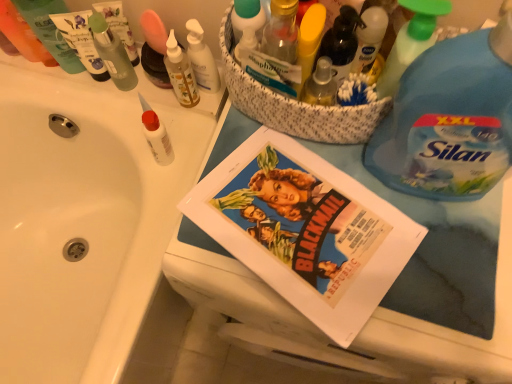
Question: Is translucent glass bottle at upper center, the first toiletry in the right-to-left sequence, beside green plastic spray bottle at upper right, marked as the 2th cleaning product in a right-to-left arrangement?

Choices:
 (A) yes
 (B) no

Answer: (B)

Question: Considering the relative sizes of translucent glass bottle at upper center, the first toiletry in the right-to-left sequence, and green plastic spray bottle at upper right, placed as the 1th cleaning product when sorted from left to right, in the image provided, is translucent glass bottle at upper center, the first toiletry in the right-to-left sequence, thinner than green plastic spray bottle at upper right, placed as the 1th cleaning product when sorted from left to right,?

Choices:
 (A) yes
 (B) no

Answer: (B)

Question: Does translucent glass bottle at upper center, which is the eighth toiletry from left to right, have a larger size compared to green plastic spray bottle at upper right, marked as the 2th cleaning product in a right-to-left arrangement?

Choices:
 (A) no
 (B) yes

Answer: (A)

Question: Is translucent glass bottle at upper center, the first toiletry in the right-to-left sequence, taller than green plastic spray bottle at upper right, marked as the 2th cleaning product in a right-to-left arrangement?

Choices:
 (A) no
 (B) yes

Answer: (A)

Question: Is translucent glass bottle at upper center, which is the eighth toiletry from left to right, further to the viewer compared to green plastic spray bottle at upper right, marked as the 2th cleaning product in a right-to-left arrangement?

Choices:
 (A) no
 (B) yes

Answer: (B)

Question: Is translucent glass bottle at upper center, the first toiletry in the right-to-left sequence, wider or thinner than matte paper comic book at center?

Choices:
 (A) thin
 (B) wide

Answer: (A)

Question: From the image's perspective, is translucent glass bottle at upper center, which is the eighth toiletry from left to right, positioned above or below matte paper comic book at center?

Choices:
 (A) below
 (B) above

Answer: (B)

Question: Is translucent glass bottle at upper center, which is the eighth toiletry from left to right, in front of or behind matte paper comic book at center in the image?

Choices:
 (A) front
 (B) behind

Answer: (A)

Question: Considering the positions of point (295, 29) and point (362, 246), is point (295, 29) closer or farther from the camera than point (362, 246)?

Choices:
 (A) closer
 (B) farther

Answer: (A)

Question: In the image, is green plastic tube at upper left, placed as the 7th toiletry when sorted from right to left, on the left side or the right side of white matte glue at upper left, placed as the 4th toiletry when sorted from right to left?

Choices:
 (A) left
 (B) right

Answer: (A)

Question: From a real-world perspective, relative to white matte glue at upper left, the fifth toiletry from the left, is green plastic tube at upper left, arranged as the 2th toiletry when viewed from the left, vertically above or below?

Choices:
 (A) above
 (B) below

Answer: (A)

Question: Looking at the image, does green plastic tube at upper left, arranged as the 2th toiletry when viewed from the left, seem bigger or smaller compared to white matte glue at upper left, placed as the 4th toiletry when sorted from right to left?

Choices:
 (A) big
 (B) small

Answer: (A)

Question: Is green plastic tube at upper left, arranged as the 2th toiletry when viewed from the left, taller or shorter than white matte glue at upper left, the fifth toiletry from the left?

Choices:
 (A) short
 (B) tall

Answer: (B)

Question: Relative to green plastic spray bottle at upper right, marked as the 2th cleaning product in a right-to-left arrangement, is translucent plastic bottle at upper center in front or behind?

Choices:
 (A) behind
 (B) front

Answer: (A)

Question: Considering the positions of point (350, 41) and point (407, 51), is point (350, 41) closer or farther from the camera than point (407, 51)?

Choices:
 (A) closer
 (B) farther

Answer: (B)